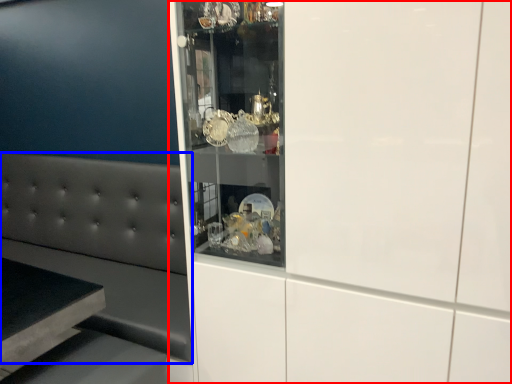
Question: Which object is further to the camera taking this photo, cabinetry (highlighted by a red box) or furniture (highlighted by a blue box)?

Choices:
 (A) cabinetry
 (B) furniture

Answer: (B)